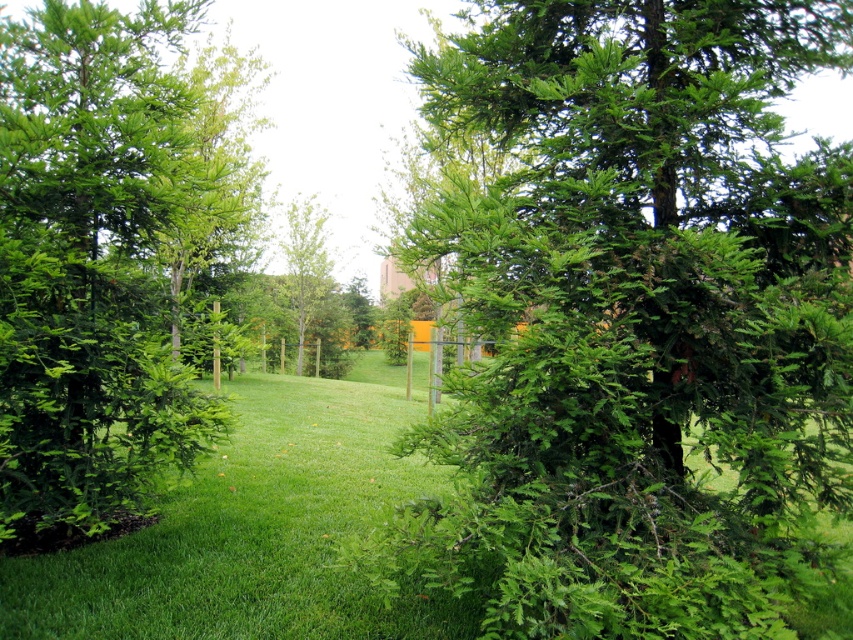
Is green needle-like at center to the right of green needle-like at left from the viewer's perspective?

Correct, you'll find green needle-like at center to the right of green needle-like at left.

Between point (567, 572) and point (224, 90), which one is positioned in front?

Point (567, 572) is more forward.

Locate an element on the screen. green needle-like at center is located at coordinates (636, 320).

Between green needle-like at left and green leafy tree at center, which one appears on the left side from the viewer's perspective?

green leafy tree at center

Where is `green needle-like at left`? Image resolution: width=853 pixels, height=640 pixels. green needle-like at left is located at coordinates (109, 259).

Is point (677, 44) positioned behind point (309, 266)?

No, (677, 44) is closer to viewer.

Which is behind, point (527, 561) or point (299, 275)?

The point (299, 275) is behind.

You are a GUI agent. You are given a task and a screenshot of the screen. Output one action in this format:
    pyautogui.click(x=<x>, y=<y>)
    Task: Click on the green needle-like at center
    
    Given the screenshot: What is the action you would take?
    pyautogui.click(x=636, y=320)